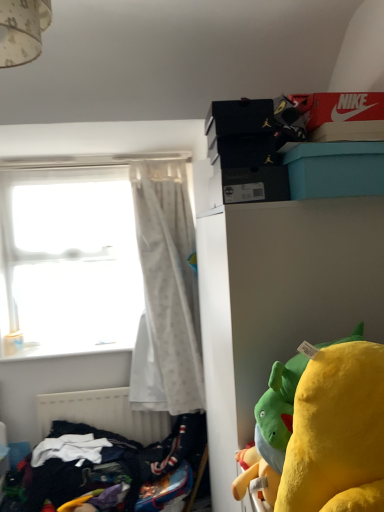
Question: From the image's perspective, would you say white matte radiator at lower left is positioned over dark blue fabric at lower left?

Choices:
 (A) no
 (B) yes

Answer: (B)

Question: Can you confirm if white matte radiator at lower left is shorter than dark blue fabric at lower left?

Choices:
 (A) yes
 (B) no

Answer: (B)

Question: Is white matte radiator at lower left to the right of dark blue fabric at lower left from the viewer's perspective?

Choices:
 (A) yes
 (B) no

Answer: (B)

Question: Considering the relative sizes of white matte radiator at lower left and dark blue fabric at lower left in the image provided, is white matte radiator at lower left bigger than dark blue fabric at lower left?

Choices:
 (A) yes
 (B) no

Answer: (B)

Question: Is white matte radiator at lower left smaller than dark blue fabric at lower left?

Choices:
 (A) yes
 (B) no

Answer: (A)

Question: From a real-world perspective, is white matte radiator at lower left on dark blue fabric at lower left?

Choices:
 (A) no
 (B) yes

Answer: (B)

Question: Considering the relative positions of white matte radiator at lower left and white matte cabinet at upper right in the image provided, is white matte radiator at lower left behind white matte cabinet at upper right?

Choices:
 (A) yes
 (B) no

Answer: (A)

Question: Is white matte radiator at lower left outside of white matte cabinet at upper right?

Choices:
 (A) yes
 (B) no

Answer: (A)

Question: From the image's perspective, is white matte radiator at lower left on white matte cabinet at upper right?

Choices:
 (A) no
 (B) yes

Answer: (A)

Question: Considering the relative sizes of white matte radiator at lower left and white matte cabinet at upper right in the image provided, is white matte radiator at lower left thinner than white matte cabinet at upper right?

Choices:
 (A) no
 (B) yes

Answer: (B)

Question: Is white matte radiator at lower left shorter than white matte cabinet at upper right?

Choices:
 (A) yes
 (B) no

Answer: (A)

Question: Is white matte radiator at lower left positioned in front of white matte cabinet at upper right?

Choices:
 (A) yes
 (B) no

Answer: (B)

Question: From the image's perspective, is teal plastic box at upper right on transparent glass window at left?

Choices:
 (A) no
 (B) yes

Answer: (B)